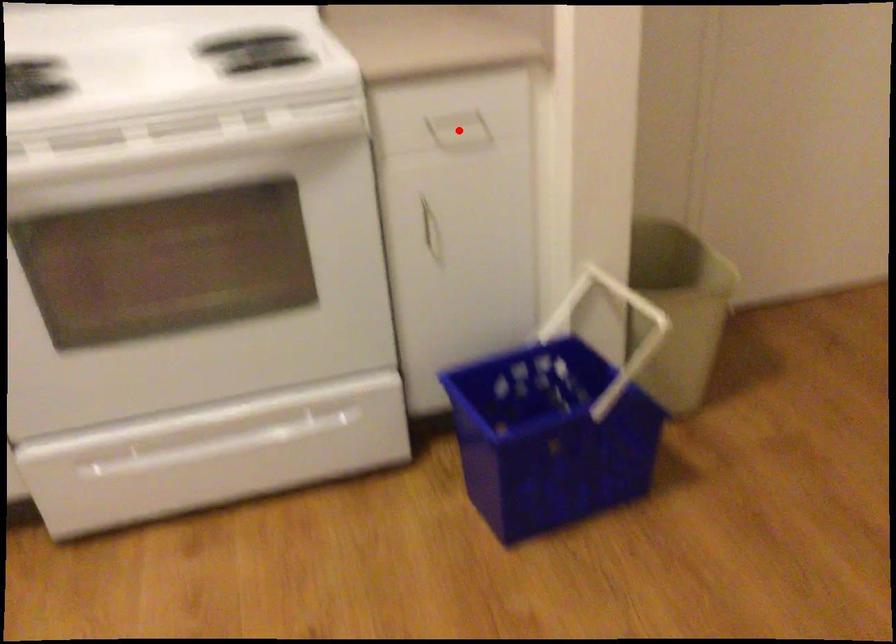
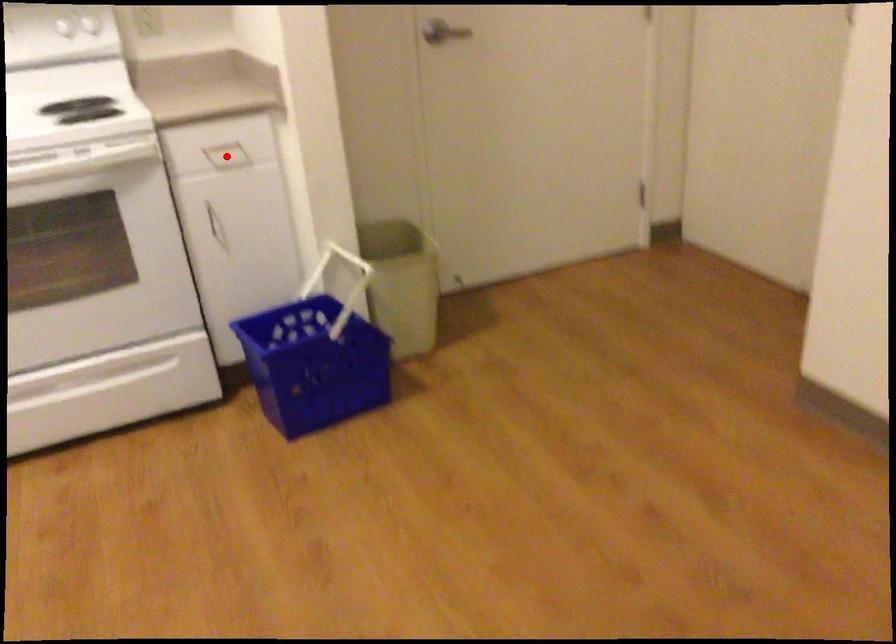
I am providing you with two images of the same scene from different viewpoints. A red point is marked on the first image and another point is marked on the second image. Is the red point in image1 aligned with the point shown in image2?

Yes